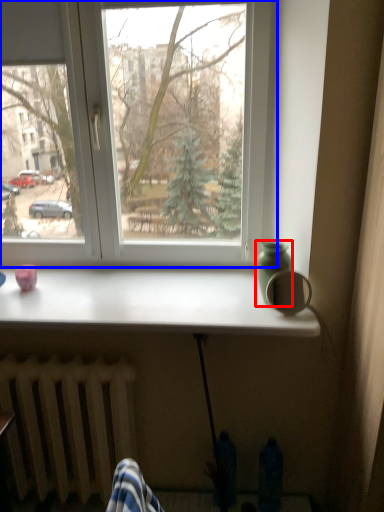
Question: Which object is further to the camera taking this photo, glass vase (highlighted by a red box) or window (highlighted by a blue box)?

Choices:
 (A) glass vase
 (B) window

Answer: (B)